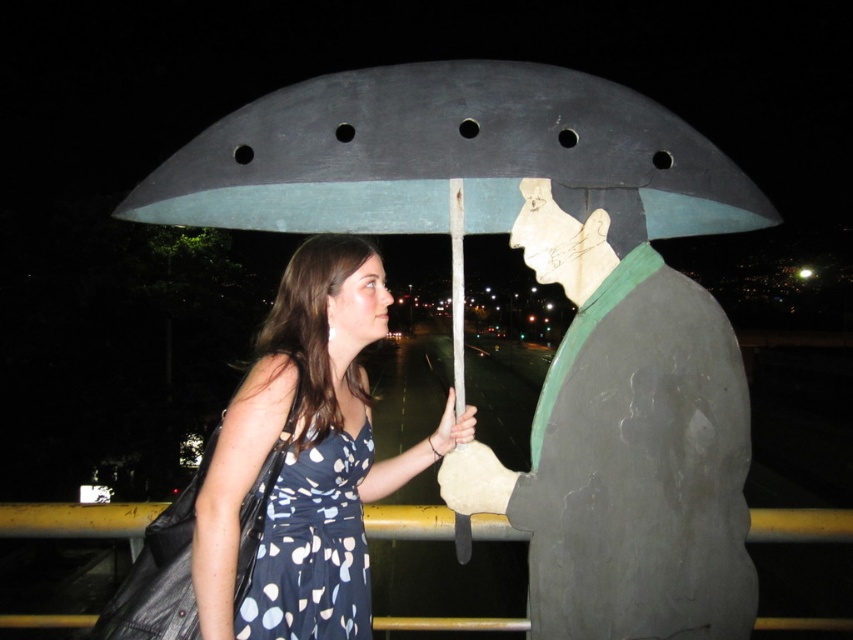
Question: Which point is farther from the camera taking this photo?

Choices:
 (A) (207, 538)
 (B) (457, 621)

Answer: (B)

Question: Can you confirm if matte gray statue at center is positioned to the right of polka dot dress at center?

Choices:
 (A) no
 (B) yes

Answer: (B)

Question: Which point appears farthest from the camera in this image?

Choices:
 (A) (817, 628)
 (B) (712, 307)
 (C) (345, 582)
 (D) (421, 122)

Answer: (A)

Question: Can you confirm if blue dotted fabric dress at center is positioned above yellow metal/rail at lower center?

Choices:
 (A) no
 (B) yes

Answer: (B)

Question: Which object is the closest to the yellow metal/rail at lower center?

Choices:
 (A) blue dotted fabric dress at center
 (B) metallic gray umbrella at center
 (C) polka dot dress at center
 (D) matte gray statue at center

Answer: (A)

Question: Does metallic gray umbrella at center come in front of polka dot dress at center?

Choices:
 (A) yes
 (B) no

Answer: (A)